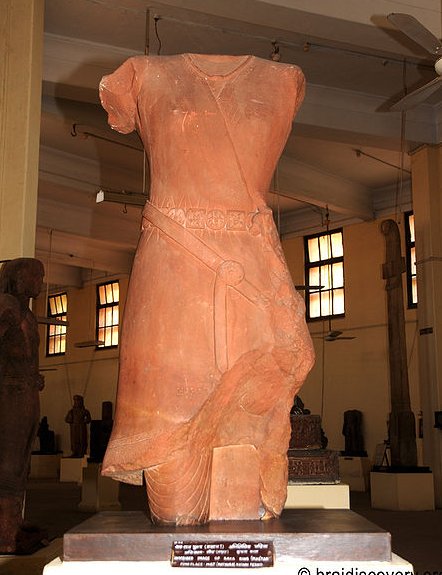
Where is `mini statue`? The image size is (442, 575). mini statue is located at coordinates (78, 421).